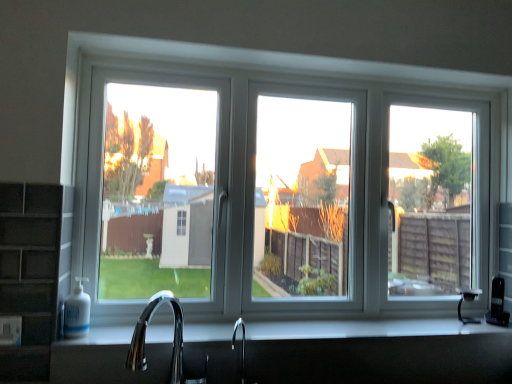
I want to click on free space above white glossy countertop at center (from a real-world perspective), so (x=337, y=324).